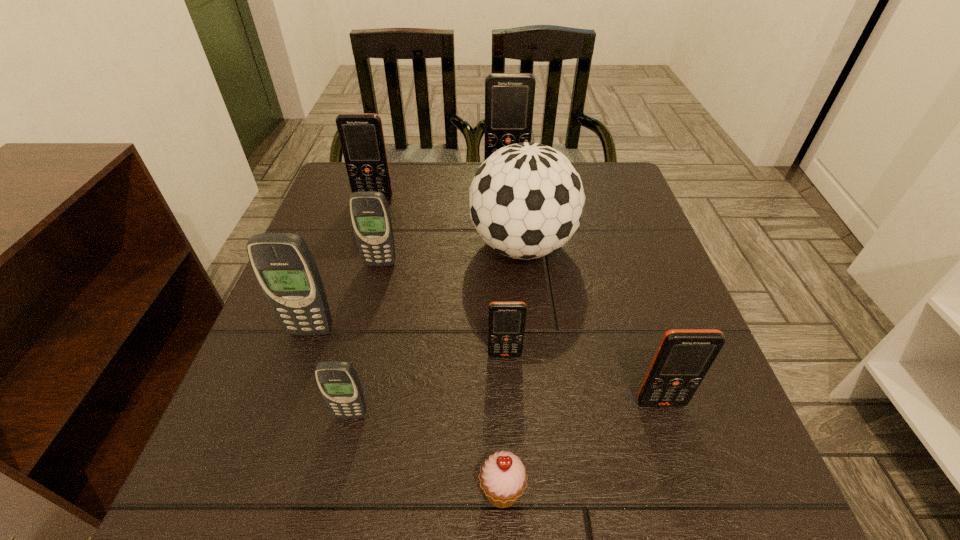
Locate an element on the screen. vacant region at the left edge of the desktop is located at coordinates (354, 304).

In the image, there is a desktop. Where is `free region at the right edge`? This screenshot has height=540, width=960. free region at the right edge is located at coordinates (635, 249).

The image size is (960, 540). I want to click on vacant area at the near left corner, so click(x=300, y=474).

Identify the location of vacant space at the far right corner of the desktop. (613, 193).

The height and width of the screenshot is (540, 960). Find the location of `unoccupied area between the second nearest orange cellular telephone and the second farthest orange cellular telephone`. unoccupied area between the second nearest orange cellular telephone and the second farthest orange cellular telephone is located at coordinates (440, 276).

Find the location of a particular element. Image resolution: width=960 pixels, height=540 pixels. vacant area that lies between the biggest orange cellular telephone and the second nearest orange cellular telephone is located at coordinates (506, 265).

Locate an element on the screen. unoccupied area between the soccer ball and the smallest orange cellular telephone is located at coordinates (514, 301).

Where is `empty location between the second nearest orange cellular telephone and the third farthest cellular telephone`? The height and width of the screenshot is (540, 960). empty location between the second nearest orange cellular telephone and the third farthest cellular telephone is located at coordinates (443, 309).

Identify the location of free area in between the farthest gray cellular telephone and the nearest gray cellular telephone. The image size is (960, 540). (366, 339).

At what (x,y) coordinates should I click in order to perform the action: click on vacant area that lies between the nearest gray cellular telephone and the fifth nearest cellular telephone. Please return your answer as a coordinate pair (x, y). This screenshot has width=960, height=540. Looking at the image, I should click on (366, 339).